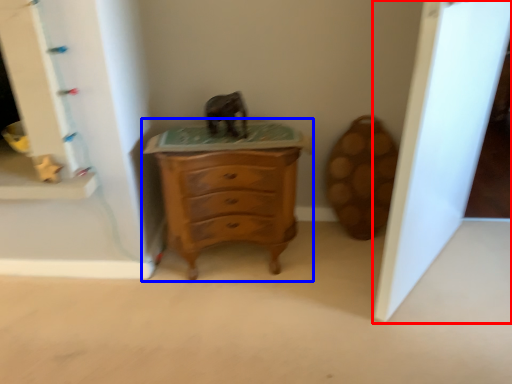
Question: Which object is closer to the camera taking this photo, glass door (highlighted by a red box) or chest of drawers (highlighted by a blue box)?

Choices:
 (A) glass door
 (B) chest of drawers

Answer: (A)